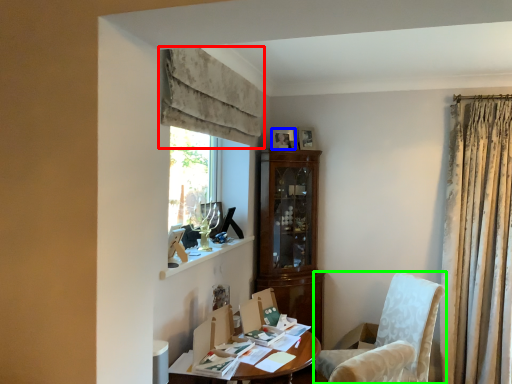
Question: Based on their relative distances, which object is nearer to curtain (highlighted by a red box)? Choose from picture frame (highlighted by a blue box) and chair (highlighted by a green box).

Choices:
 (A) picture frame
 (B) chair

Answer: (A)